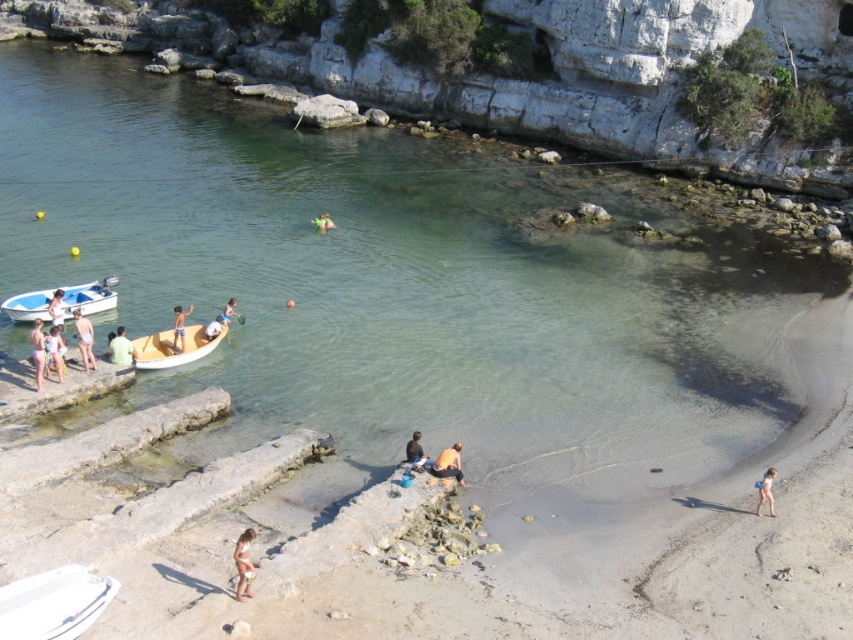
Does point (172, 358) come in front of point (312, 225)?

Yes, it is.

Does wooden boat at center-left have a smaller size compared to green fabric at center?

No.

Is point (190, 346) farther from viewer compared to point (320, 214)?

No, (190, 346) is closer to viewer.

Find the location of a particular element. This screenshot has height=640, width=853. wooden boat at center-left is located at coordinates (172, 348).

Consider the image. Can you confirm if beige fabric bikini at lower center is positioned above light brown wooden paddleboard at center-left?

Actually, beige fabric bikini at lower center is below light brown wooden paddleboard at center-left.

Can you confirm if beige fabric bikini at lower center is wider than light brown wooden paddleboard at center-left?

Yes, beige fabric bikini at lower center is wider than light brown wooden paddleboard at center-left.

Find the location of a particular element. The height and width of the screenshot is (640, 853). beige fabric bikini at lower center is located at coordinates (242, 563).

Who is more distant from viewer, (660,364) or (759,499)?

Point (660,364)

Is clear water at lower center behind blue fabric at lower right?

Yes, clear water at lower center is further from the viewer.

Which is behind, point (740, 252) or point (773, 472)?

Positioned behind is point (740, 252).

The height and width of the screenshot is (640, 853). What are the coordinates of `clear water at lower center` in the screenshot? It's located at (393, 289).